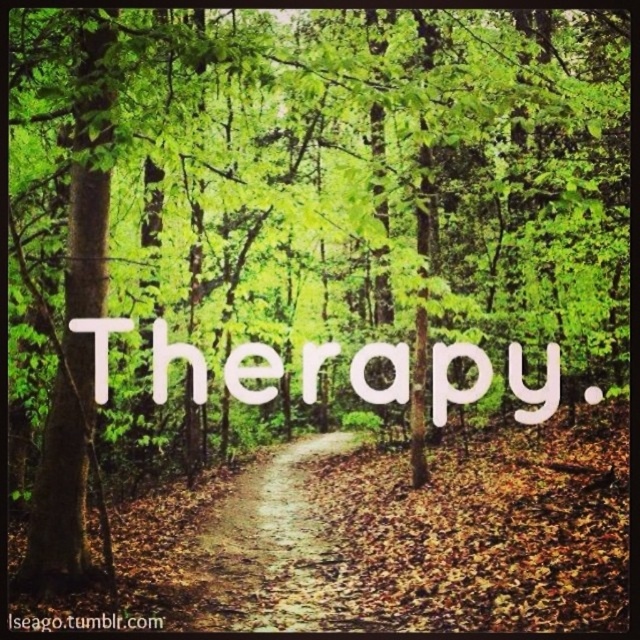
You are standing on the winding dirt path in the forest and see two points marked on the ground. The first point is at coordinate point (230, 529) and the second is at point (156, 320). Which point is closer to you?

Point (230, 529) is further to the viewer than point (156, 320), so the point at (156, 320) is closer to you.